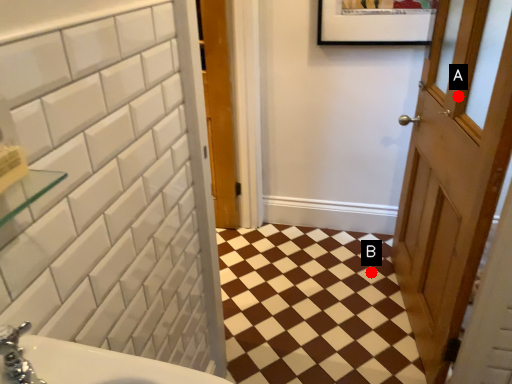
Question: Two points are circled on the image, labeled by A and B beside each circle. Among these points, which one is nearest to the camera?

Choices:
 (A) A is closer
 (B) B is closer

Answer: (A)